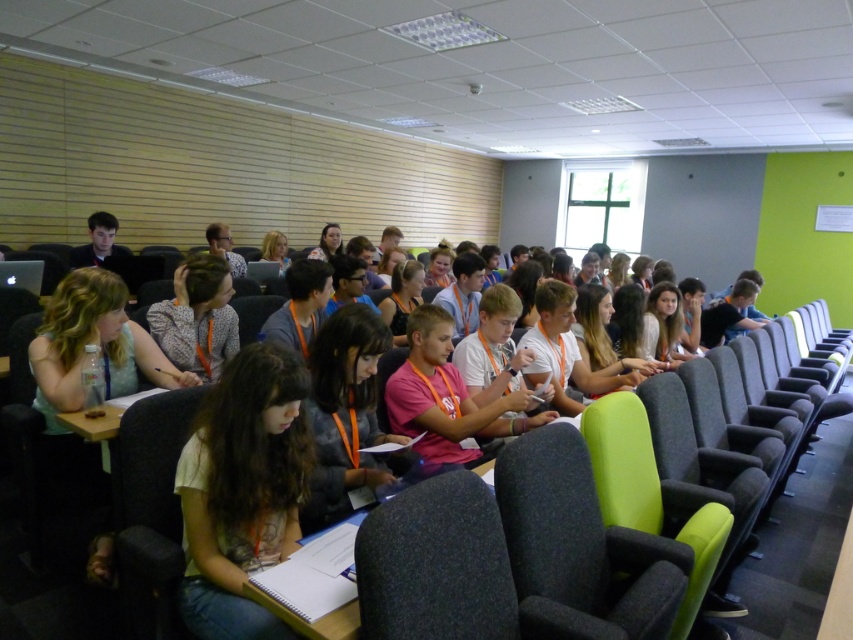
Between white cotton shirt at center and dark gray fabric chair at center, which one is positioned lower?

dark gray fabric chair at center

Who is more forward, (x=289, y=532) or (x=405, y=580)?

Point (x=405, y=580)

Locate an element on the screen. white cotton shirt at center is located at coordinates (242, 490).

This screenshot has width=853, height=640. What are the coordinates of `white cotton shirt at center` in the screenshot? It's located at (242, 490).